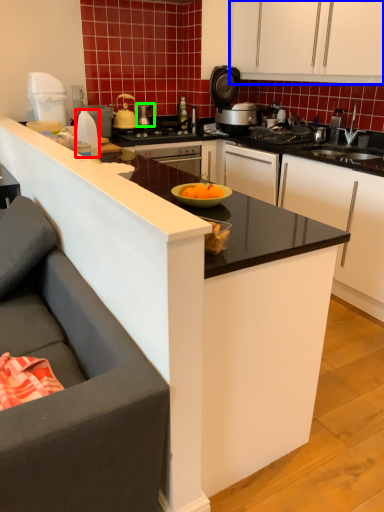
Question: Based on their relative distances, which object is farther from kitchen appliance (highlighted by a red box)? Choose from cabinetry (highlighted by a blue box) and kitchen appliance (highlighted by a green box).

Choices:
 (A) cabinetry
 (B) kitchen appliance

Answer: (A)